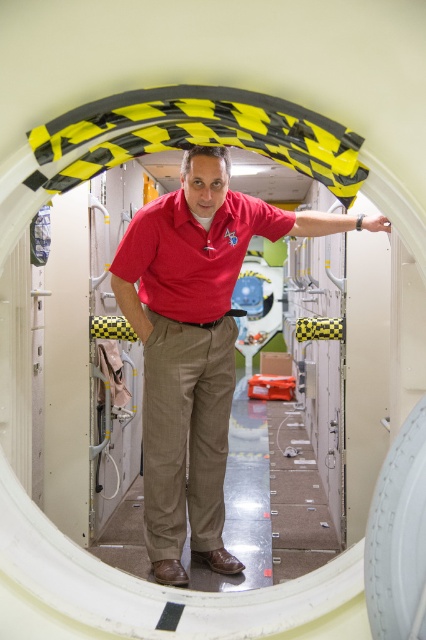
Between khaki fabric trousers at center and matte red polo shirt at center, which one is positioned lower?

khaki fabric trousers at center is lower down.

What do you see at coordinates (186, 440) in the screenshot? The height and width of the screenshot is (640, 426). I see `khaki fabric trousers at center` at bounding box center [186, 440].

Measure the distance between point (195, 474) and camera.

The distance of point (195, 474) from camera is 9.27 feet.

Find the location of a particular element. Image resolution: width=426 pixels, height=640 pixels. khaki fabric trousers at center is located at coordinates pyautogui.click(x=186, y=440).

Can you confirm if matte red shirt at center is thinner than matte red polo shirt at center?

No, matte red shirt at center is not thinner than matte red polo shirt at center.

Is point (201, 477) closer to viewer compared to point (158, 250)?

No, it is not.

Where is `matte red shirt at center`? The height and width of the screenshot is (640, 426). matte red shirt at center is located at coordinates (195, 344).

Who is positioned more to the right, matte red shirt at center or khaki fabric trousers at center?

matte red shirt at center is more to the right.

Does point (155, 397) come farther from viewer compared to point (155, 362)?

Yes, it is behind point (155, 362).

Where is `matte red shirt at center`? matte red shirt at center is located at coordinates (195, 344).